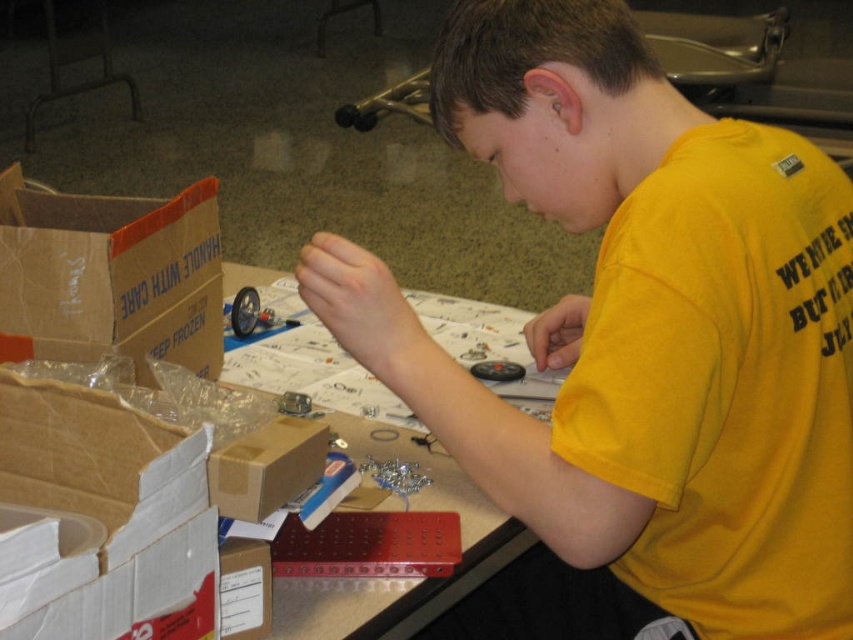
How far apart are the yellow matte shirt at center and the black remote control on the table?

The yellow matte shirt at center and the black remote control on the table are 25.76 inches apart.

You are standing in front of the table where the mechanical project is being assembled. You need to place a tool on the surface. Which object, the yellow matte shirt at center or the white paper at center, is closer to you where you can easily reach it?

The yellow matte shirt at center is closer to the viewer than the white paper at center, so you can easily reach it.

You are an observer looking at the person working on the table. Which object, the yellow matte shirt at center or the white paper at center, takes up more space in the scene?

The yellow matte shirt at center has a larger size compared to the white paper at center, so it takes up more space in the scene.